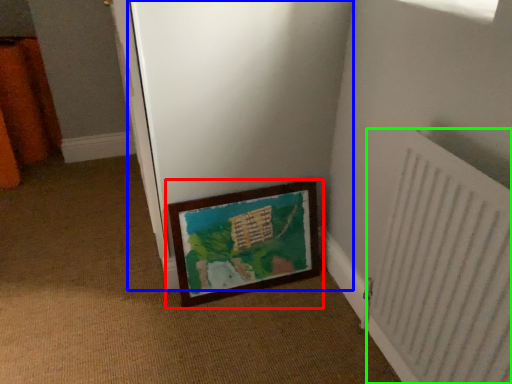
Question: Considering the real-world distances, which object is closest to picture frame (highlighted by a red box)? screen door (highlighted by a blue box) or radiator (highlighted by a green box).

Choices:
 (A) screen door
 (B) radiator

Answer: (A)